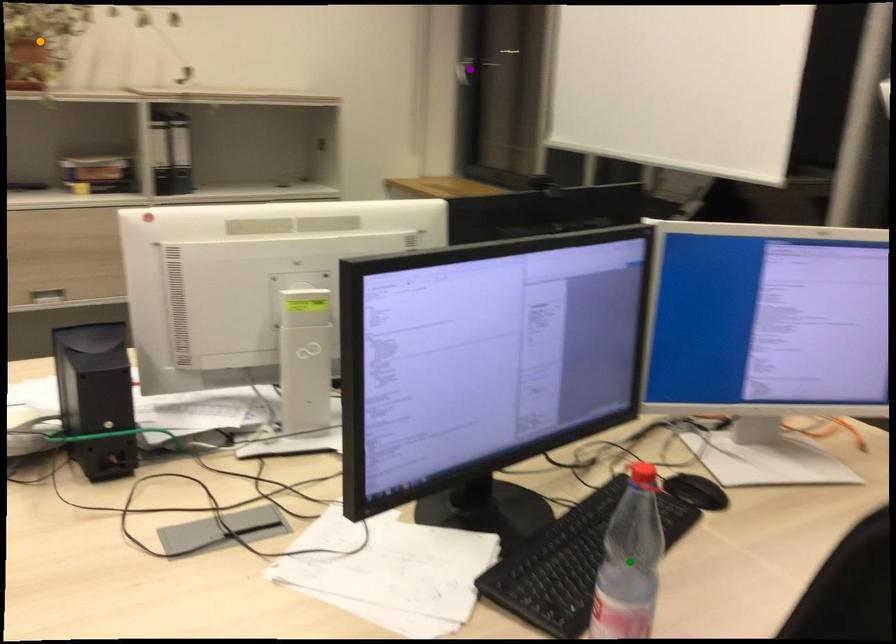
Order these from nearest to farthest:
- purple point
- green point
- orange point

purple point
orange point
green point